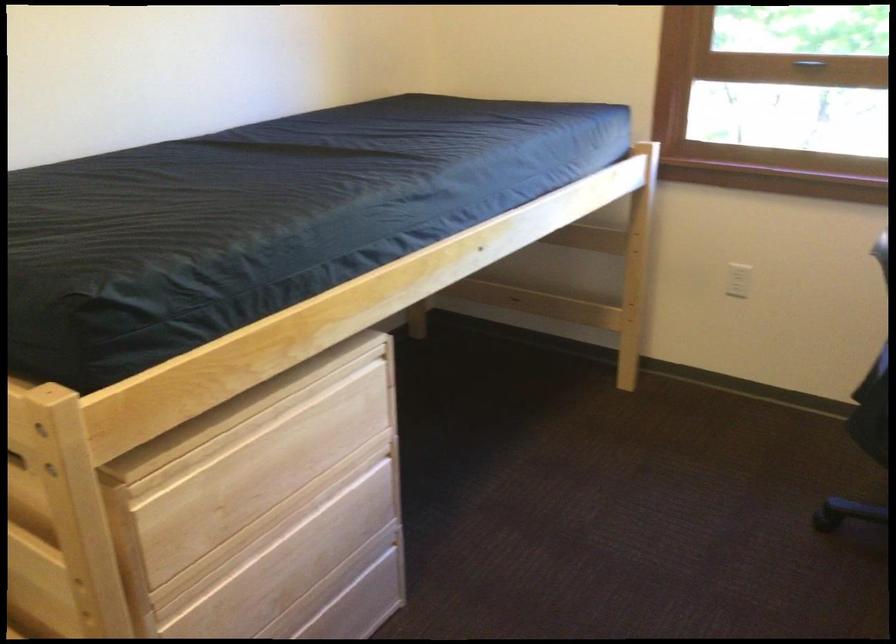
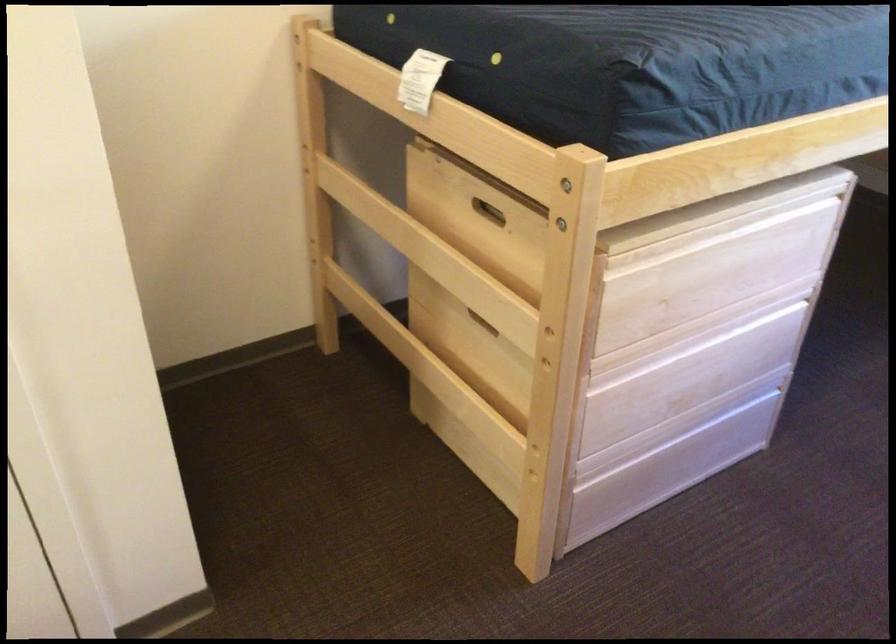
Question: The camera is either moving clockwise (left) or counter-clockwise (right) around the object. The first image is from the beginning of the video and the second image is from the end. Is the camera moving left or right when shooting the video?

Choices:
 (A) Left
 (B) Right

Answer: (B)